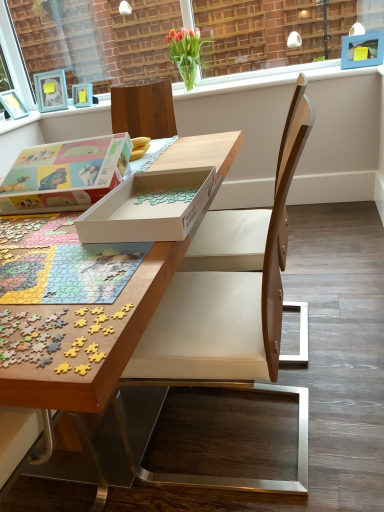
Question: From the image's perspective, relative to wooden puzzle pieces at center, is white matte window sill at upper center above or below?

Choices:
 (A) below
 (B) above

Answer: (B)

Question: In the image, is white matte window sill at upper center on the left side or the right side of wooden puzzle pieces at center?

Choices:
 (A) right
 (B) left

Answer: (A)

Question: Estimate the real-world distances between objects in this image. Which object is closer to the wooden puzzle pieces at center?

Choices:
 (A) blue plastic picture frame at upper right, the 2th picture frame in the left-to-right sequence
 (B) white cardboard box at center, which is the second box from right to left
 (C) white cardboard box at center, the 2th box from the left
 (D) vivid tulips in glass vase at upper center
 (E) wooden chair at center

Answer: (C)

Question: Estimate the real-world distances between objects in this image. Which object is closer to the blue plastic picture frame at upper right, placed as the 1th picture frame when sorted from right to left?

Choices:
 (A) matte blue picture frame at upper left, the 1th picture frame when ordered from back to front
 (B) wooden puzzle pieces at center
 (C) white plastic window frame at upper center
 (D) white cardboard box at center, the 1th box when ordered from right to left
 (E) white cardboard box at center, which ranks as the 1th box in left-to-right order

Answer: (B)